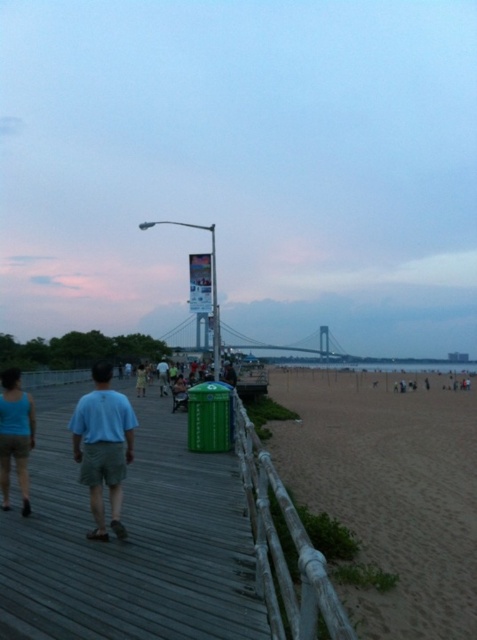
Question: Which of these objects is positioned closest to the light blue t-shirt at center?

Choices:
 (A) light blue cotton shirt at center
 (B) matte blue tank top at left

Answer: (A)

Question: Which of these objects is positioned farthest from the dark wood boardwalk at center?

Choices:
 (A) light blue t-shirt at center
 (B) matte blue tank top at left

Answer: (A)

Question: Considering the relative positions of matte blue tank top at left and light blue t-shirt at center in the image provided, where is matte blue tank top at left located with respect to light blue t-shirt at center?

Choices:
 (A) below
 (B) above

Answer: (B)

Question: Which of the following is the closest to the observer?

Choices:
 (A) (436, 582)
 (B) (112, 432)
 (C) (300, 541)

Answer: (C)

Question: Is weathered wood rail at lower center smaller than matte blue tank top at left?

Choices:
 (A) yes
 (B) no

Answer: (B)

Question: From the image, what is the correct spatial relationship of matte blue tank top at left in relation to light blue t-shirt at center?

Choices:
 (A) right
 (B) left

Answer: (A)